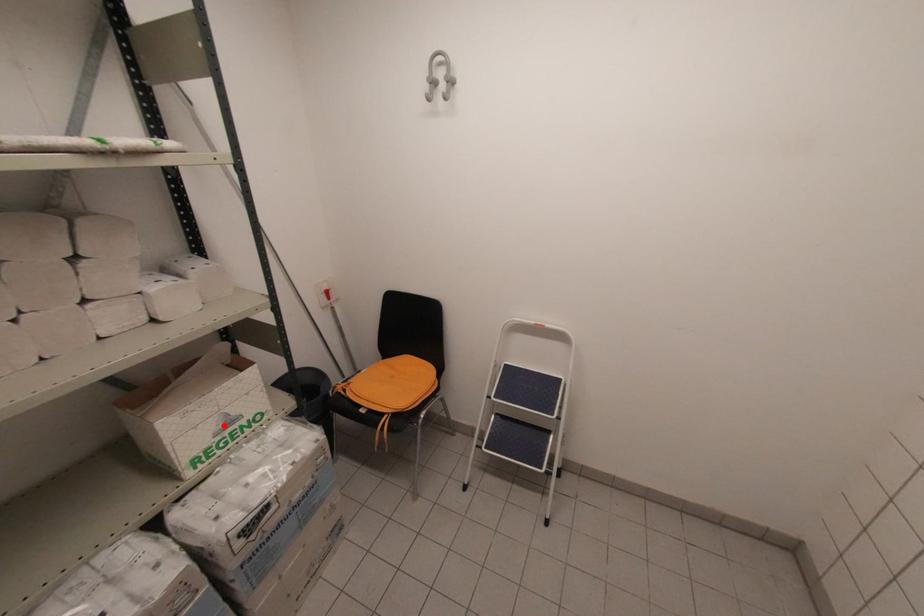
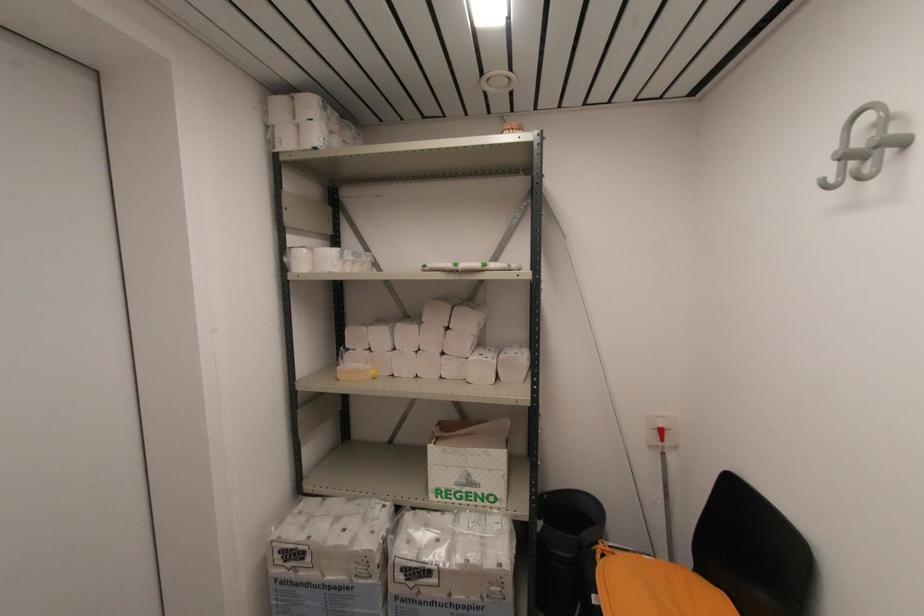
Find the pixel in the second image that matches the highlighted location in the first image.

(465, 480)